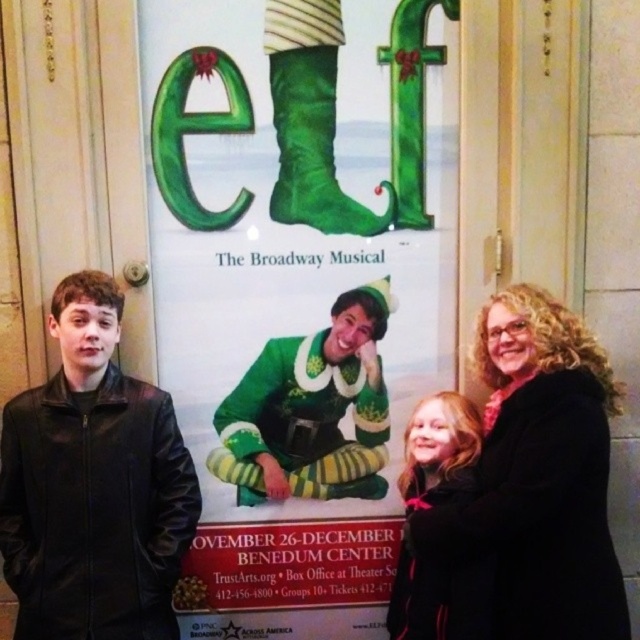
In the scene shown: Who is more forward, [156,637] or [564,609]?

Point [564,609] is more forward.

Which is behind, point (64, 568) or point (448, 560)?

Point (64, 568)

Identify the location of black leather jacket at left. This screenshot has height=640, width=640. (93, 484).

Is black wool coat at right positioned at the back of green felt boot at center?

No.

Find the location of a particular element. The image size is (640, 640). black wool coat at right is located at coordinates (538, 476).

Does point (131, 413) lie behind point (307, 140)?

That is False.

Identify the location of black leather jacket at left. (93, 484).

Find the location of `black leather jacket at left`. black leather jacket at left is located at coordinates (93, 484).